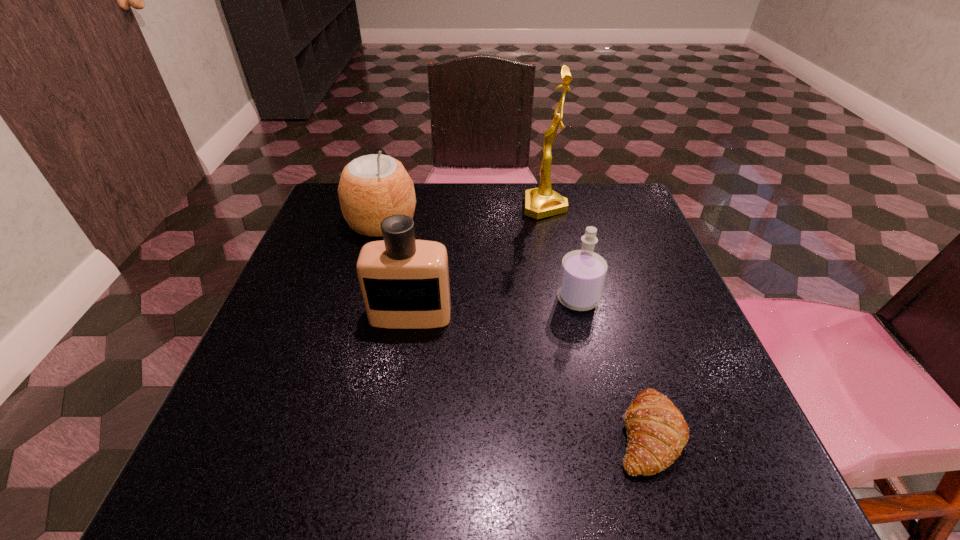
The image size is (960, 540). What are the coordinates of `vacant space located 0.280m on the front of the coconut` in the screenshot? It's located at (349, 338).

This screenshot has height=540, width=960. Identify the location of free location located on the front label of the taller perfume. (400, 379).

Where is `free space located on the back of the right perfume`? The image size is (960, 540). free space located on the back of the right perfume is located at coordinates (556, 206).

Find the location of a particular element. Image resolution: width=960 pixels, height=540 pixels. vacant space located 0.140m on the left of the shortest object is located at coordinates (521, 433).

This screenshot has height=540, width=960. Identify the location of award that is at the far edge. click(541, 202).

Identify the location of coconut located in the far edge section of the desktop. The width and height of the screenshot is (960, 540). (372, 187).

Where is `object that is at the near edge`? object that is at the near edge is located at coordinates (657, 433).

Identify the location of object present at the left edge. Image resolution: width=960 pixels, height=540 pixels. (372, 187).

At what (x,y) coordinates should I click in order to perform the action: click on object located in the right edge section of the desktop. Please return your answer as a coordinate pair (x, y). This screenshot has height=540, width=960. Looking at the image, I should click on (657, 433).

Where is `object located in the far left corner section of the desktop`? object located in the far left corner section of the desktop is located at coordinates (372, 187).